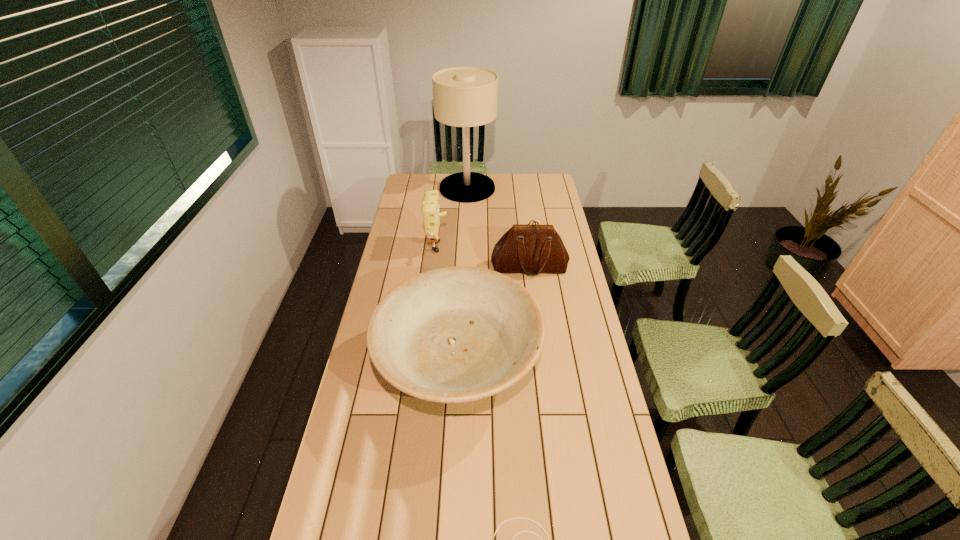
Where is `table lamp`? Image resolution: width=960 pixels, height=540 pixels. table lamp is located at coordinates (465, 97).

Identify the location of the tallest object. (465, 97).

Locate an element on the screen. This screenshot has width=960, height=540. sponge is located at coordinates (430, 209).

You are a GUI agent. You are given a task and a screenshot of the screen. Output one action in this format:
    pyautogui.click(x=<x>, y=<y>)
    Task: Click on the shoulder bag
    The image size is (960, 540).
    Given the screenshot: What is the action you would take?
    click(x=532, y=249)

Image resolution: width=960 pixels, height=540 pixels. I want to click on the second nearest object, so click(458, 334).

Locate an element on the screen. The height and width of the screenshot is (540, 960). vacant space located 0.140m on the front of the tallest object is located at coordinates (466, 218).

Where is `vacant space situated on the face of the sponge`? The height and width of the screenshot is (540, 960). vacant space situated on the face of the sponge is located at coordinates (464, 250).

This screenshot has height=540, width=960. I want to click on free point located 0.380m on the left of the shoulder bag, so click(402, 267).

Find the location of a particular element. vacant region located 0.210m on the right of the second nearest object is located at coordinates (601, 368).

Image resolution: width=960 pixels, height=540 pixels. What are the coordinates of `object present at the far edge` in the screenshot? It's located at (465, 97).